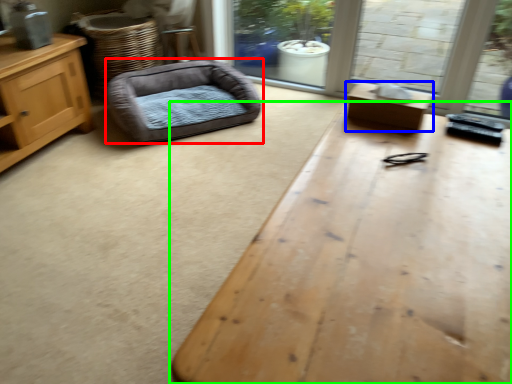
Question: Estimate the real-world distances between objects in this image. Which object is closer to dog bed (highlighted by a red box), table (highlighted by a blue box) or table (highlighted by a green box)?

Choices:
 (A) table
 (B) table

Answer: (A)